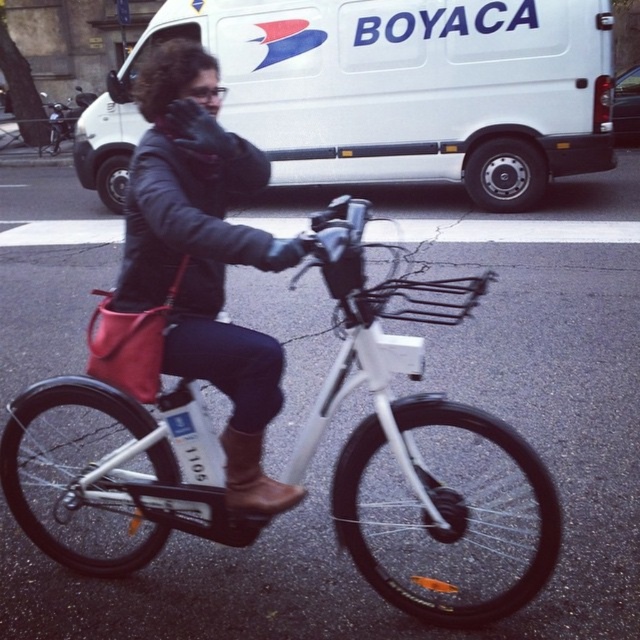
Between white matte bicycle at center and brown leather boot at center, which one has less height?

Standing shorter between the two is brown leather boot at center.

At what (x,y) coordinates should I click in order to perform the action: click on white matte bicycle at center. Please return your answer as a coordinate pair (x, y). The width and height of the screenshot is (640, 640). Looking at the image, I should click on (417, 448).

Describe the element at coordinates (417, 448) in the screenshot. I see `white matte bicycle at center` at that location.

I want to click on white matte bicycle at center, so click(x=417, y=448).

Can you confirm if leather jacket at center is positioned to the right of brown leather boot at center?

No, leather jacket at center is not to the right of brown leather boot at center.

Who is shorter, leather jacket at center or brown leather boot at center?

With less height is brown leather boot at center.

Is point (260, 170) positioned after point (250, 444)?

That is True.

At what (x,y) coordinates should I click in order to perform the action: click on leather jacket at center. Please return your answer as a coordinate pair (x, y). Image resolution: width=640 pixels, height=640 pixels. Looking at the image, I should click on (204, 257).

Who is higher up, white matte van at upper center or brown leather boot at center?

white matte van at upper center is above.

Measure the distance between white matte van at upper center and camera.

A distance of 8.34 meters exists between white matte van at upper center and camera.

Between point (276, 93) and point (237, 452), which one is positioned behind?

Positioned behind is point (276, 93).

Locate an element on the screen. white matte van at upper center is located at coordinates (387, 92).